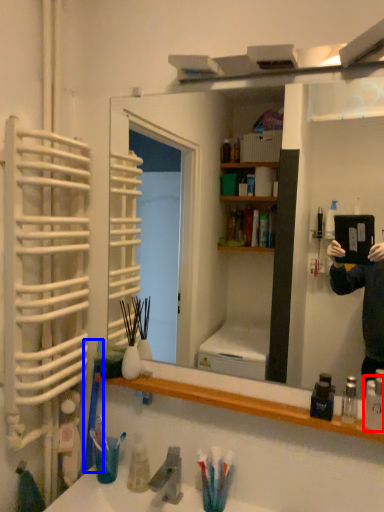
Question: Which of the following is the closest to the observer, toiletry (highlighted by a red box) or toothbrush (highlighted by a blue box)?

Choices:
 (A) toiletry
 (B) toothbrush

Answer: (A)